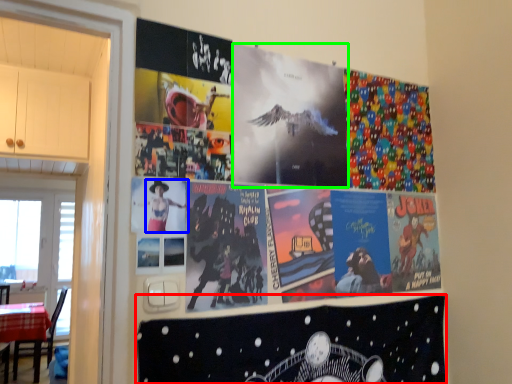
Question: Which object is the farthest from album cover (highlighted by a red box)? Choose among these: person (highlighted by a blue box) or movie poster (highlighted by a green box).

Choices:
 (A) person
 (B) movie poster

Answer: (A)